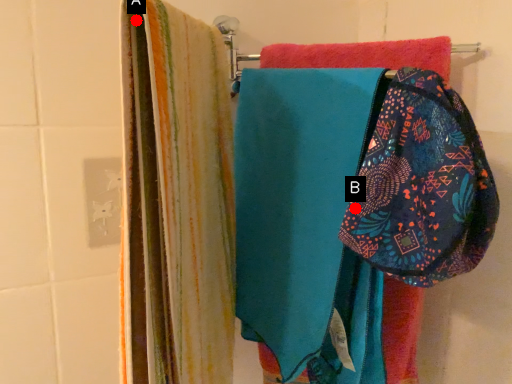
Question: Two points are circled on the image, labeled by A and B beside each circle. Which point is closer to the camera?

Choices:
 (A) A is closer
 (B) B is closer

Answer: (A)